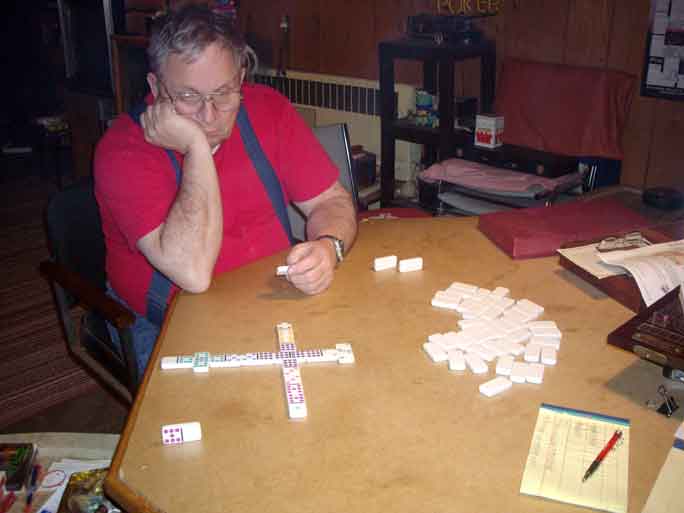
Find the location of a particular element. back of chair is located at coordinates (339, 134), (73, 160).